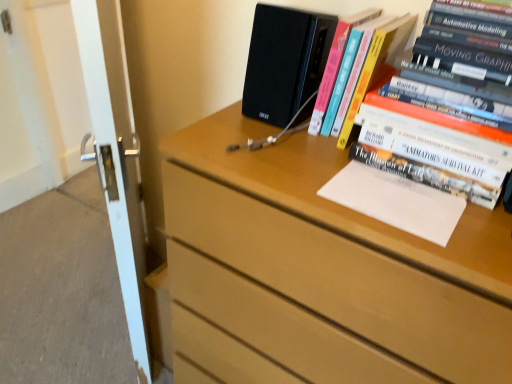
This screenshot has width=512, height=384. What do you see at coordinates (396, 201) in the screenshot?
I see `white paper at upper right` at bounding box center [396, 201].

Looking at this image, what is the approximate height of wooden chest of drawers at upper right?

wooden chest of drawers at upper right is 98.96 centimeters tall.

The width and height of the screenshot is (512, 384). I want to click on white paper at upper right, so click(x=396, y=201).

Which object is closer to the camera taking this photo, hardcover books at upper right, positioned as the 2th book in left-to-right order, or white paper at upper right?

hardcover books at upper right, positioned as the 2th book in left-to-right order, is in front.

Considering the sizes of objects hardcover books at upper right, positioned as the 2th book in left-to-right order, and white paper at upper right in the image provided, who is smaller, hardcover books at upper right, positioned as the 2th book in left-to-right order, or white paper at upper right?

Smaller between the two is white paper at upper right.

Considering the relative sizes of hardcover books at upper right, positioned as the 2th book in left-to-right order, and white paper at upper right in the image provided, is hardcover books at upper right, positioned as the 2th book in left-to-right order, shorter than white paper at upper right?

Incorrect, the height of hardcover books at upper right, positioned as the 2th book in left-to-right order, does not fall short of that of white paper at upper right.

What's the angular difference between hardcover books at upper right, positioned as the 2th book in left-to-right order, and white paper at upper right's facing directions?

0.00103 degrees separate the facing orientations of hardcover books at upper right, positioned as the 2th book in left-to-right order, and white paper at upper right.

Would you say hardcover books at upper right, positioned as the 2th book in left-to-right order, is inside or outside hardcover book at upper right, which appears as the second book when viewed from the right?

hardcover books at upper right, positioned as the 2th book in left-to-right order, lies outside hardcover book at upper right, which appears as the second book when viewed from the right.

Is point (429, 27) in front of point (393, 16)?

Yes, it is.

What's the angular difference between hardcover books at upper right, positioned as the 2th book in left-to-right order, and hardcover book at upper right, which appears as the second book when viewed from the right,'s facing directions?

The angle between the facing direction of hardcover books at upper right, positioned as the 2th book in left-to-right order, and the facing direction of hardcover book at upper right, which appears as the second book when viewed from the right, is 0.159 degrees.

Based on the photo, considering the relative positions of hardcover books at upper right, positioned as the 2th book in left-to-right order, and hardcover book at upper right, the first book in the left-to-right sequence, in the image provided, is hardcover books at upper right, positioned as the 2th book in left-to-right order, to the left of hardcover book at upper right, the first book in the left-to-right sequence, from the viewer's perspective?

Incorrect, hardcover books at upper right, positioned as the 2th book in left-to-right order, is not on the left side of hardcover book at upper right, the first book in the left-to-right sequence.

Consider the image. In terms of width, does hardcover book at upper right, which appears as the second book when viewed from the right, look wider or thinner when compared to white paper at upper right?

In the image, hardcover book at upper right, which appears as the second book when viewed from the right, appears to be wider than white paper at upper right.

From the image's perspective, which one is positioned higher, hardcover book at upper right, which appears as the second book when viewed from the right, or white paper at upper right?

hardcover book at upper right, which appears as the second book when viewed from the right, is shown above in the image.

Considering the positions of points (385, 27) and (382, 173), is point (385, 27) closer to camera compared to point (382, 173)?

That is True.

Can you confirm if hardcover book at upper right, the first book in the left-to-right sequence, is shorter than white paper at upper right?

In fact, hardcover book at upper right, the first book in the left-to-right sequence, may be taller than white paper at upper right.

From a real-world perspective, is wooden chest of drawers at upper right positioned over hardcover books at upper right, positioned as the 2th book in left-to-right order, based on gravity?

Actually, wooden chest of drawers at upper right is physically below hardcover books at upper right, positioned as the 2th book in left-to-right order, in the real world.

How far apart are wooden chest of drawers at upper right and hardcover books at upper right, positioned as the 2th book in left-to-right order?

11.31 inches.

Which is farther, (414, 323) or (498, 175)?

The point (498, 175) is farther.

Between wooden chest of drawers at upper right and hardcover books at upper right, which is the 1th book in right-to-left order, which one has less height?

With less height is hardcover books at upper right, which is the 1th book in right-to-left order.

Who is bigger, white paper at upper right or hardcover books at upper right, positioned as the 2th book in left-to-right order?

hardcover books at upper right, positioned as the 2th book in left-to-right order, is bigger.

How many degrees apart are the facing directions of white paper at upper right and hardcover books at upper right, which is the 1th book in right-to-left order?

The angular difference between white paper at upper right and hardcover books at upper right, which is the 1th book in right-to-left order, is 0.00103 degrees.

How far apart are white paper at upper right and hardcover books at upper right, which is the 1th book in right-to-left order?

white paper at upper right and hardcover books at upper right, which is the 1th book in right-to-left order, are 5.54 inches apart from each other.

From the image's perspective, which object appears higher, white paper at upper right or hardcover books at upper right, positioned as the 2th book in left-to-right order?

hardcover books at upper right, positioned as the 2th book in left-to-right order, appears higher in the image.

You are a GUI agent. You are given a task and a screenshot of the screen. Output one action in this format:
    pyautogui.click(x=<x>, y=<y>)
    Task: Click on the screen door above the wooden chest of drawers at upper right (from a real-world perspective)
    The image size is (512, 384).
    Given the screenshot: What is the action you would take?
    pyautogui.click(x=115, y=154)

Considering the sizes of objects white glossy screen door at left and wooden chest of drawers at upper right in the image provided, who is shorter, white glossy screen door at left or wooden chest of drawers at upper right?

wooden chest of drawers at upper right is shorter.

Would you consider white glossy screen door at left to be distant from wooden chest of drawers at upper right?

That's not correct — white glossy screen door at left is a little close to wooden chest of drawers at upper right.

Looking at their sizes, would you say white glossy screen door at left is wider or thinner than wooden chest of drawers at upper right?

In the image, white glossy screen door at left appears to be more narrow than wooden chest of drawers at upper right.

What's the angular difference between wooden chest of drawers at upper right and hardcover book at upper right, the first book in the left-to-right sequence,'s facing directions?

The angular difference between wooden chest of drawers at upper right and hardcover book at upper right, the first book in the left-to-right sequence, is 0.315 degrees.

Could you tell me if wooden chest of drawers at upper right is turned towards hardcover book at upper right, which appears as the second book when viewed from the right?

No, wooden chest of drawers at upper right does not turn towards hardcover book at upper right, which appears as the second book when viewed from the right.

Based on the photo, is wooden chest of drawers at upper right behind hardcover book at upper right, which appears as the second book when viewed from the right?

No, the depth of wooden chest of drawers at upper right is less than that of hardcover book at upper right, which appears as the second book when viewed from the right.

The height and width of the screenshot is (384, 512). Identify the location of the 2nd book behind when counting from the wooden chest of drawers at upper right. (370, 48).

The image size is (512, 384). In the image, there is a hardcover books at upper right, which is the 1th book in right-to-left order. Identify the location of paperback book below it (from a real-world perspective). (396, 201).

You are a GUI agent. You are given a task and a screenshot of the screen. Output one action in this format:
    pyautogui.click(x=<x>, y=<y>)
    Task: Click on the book above the hardcover book at upper right, which appears as the second book when viewed from the right (from a real-world perspective)
    Image resolution: width=512 pixels, height=384 pixels.
    Given the screenshot: What is the action you would take?
    460,63

Which object lies further to the anchor point white glossy screen door at left, hardcover book at upper right, which appears as the second book when viewed from the right, or wooden chest of drawers at upper right?

Among the two, hardcover book at upper right, which appears as the second book when viewed from the right, is located further to white glossy screen door at left.

Which object lies further to the anchor point hardcover book at upper right, the first book in the left-to-right sequence, hardcover books at upper right, which is the 1th book in right-to-left order, or white glossy screen door at left?

The object further to hardcover book at upper right, the first book in the left-to-right sequence, is white glossy screen door at left.

Considering their positions, is hardcover books at upper right, which is the 1th book in right-to-left order, positioned further to white glossy screen door at left than hardcover book at upper right, which appears as the second book when viewed from the right?

hardcover books at upper right, which is the 1th book in right-to-left order, is further to white glossy screen door at left.

Looking at the image, which one is located further to white paper at upper right, hardcover book at upper right, the first book in the left-to-right sequence, or hardcover books at upper right, which is the 1th book in right-to-left order?

The object further to white paper at upper right is hardcover book at upper right, the first book in the left-to-right sequence.

Considering their positions, is wooden chest of drawers at upper right positioned closer to hardcover book at upper right, which appears as the second book when viewed from the right, than white glossy screen door at left?

wooden chest of drawers at upper right lies closer to hardcover book at upper right, which appears as the second book when viewed from the right, than the other object.

Which object lies further to the anchor point wooden chest of drawers at upper right, white glossy screen door at left or hardcover books at upper right, which is the 1th book in right-to-left order?

white glossy screen door at left is positioned further to the anchor wooden chest of drawers at upper right.

Looking at the image, which one is located closer to hardcover books at upper right, positioned as the 2th book in left-to-right order, hardcover book at upper right, the first book in the left-to-right sequence, or white paper at upper right?

white paper at upper right is closer to hardcover books at upper right, positioned as the 2th book in left-to-right order.

Looking at the image, which one is located closer to hardcover books at upper right, which is the 1th book in right-to-left order, wooden chest of drawers at upper right or white paper at upper right?

white paper at upper right.

Find the location of `book between white glossy screen door at left and hardcover books at upper right, which is the 1th book in right-to-left order, in the horizontal direction`. book between white glossy screen door at left and hardcover books at upper right, which is the 1th book in right-to-left order, in the horizontal direction is located at coordinates (370, 48).

Find the location of a particular element. The image size is (512, 384). book that lies between hardcover book at upper right, which appears as the second book when viewed from the right, and wooden chest of drawers at upper right from top to bottom is located at coordinates (460, 63).

You are a GUI agent. You are given a task and a screenshot of the screen. Output one action in this format:
    pyautogui.click(x=<x>, y=<y>)
    Task: Click on the chest of drawers between white glossy screen door at left and hardcover book at upper right, the first book in the left-to-right sequence, from left to right
    Image resolution: width=512 pixels, height=384 pixels.
    Given the screenshot: What is the action you would take?
    pyautogui.click(x=321, y=272)

Locate an element on the screen. paperback book between hardcover books at upper right, which is the 1th book in right-to-left order, and wooden chest of drawers at upper right from top to bottom is located at coordinates (396, 201).